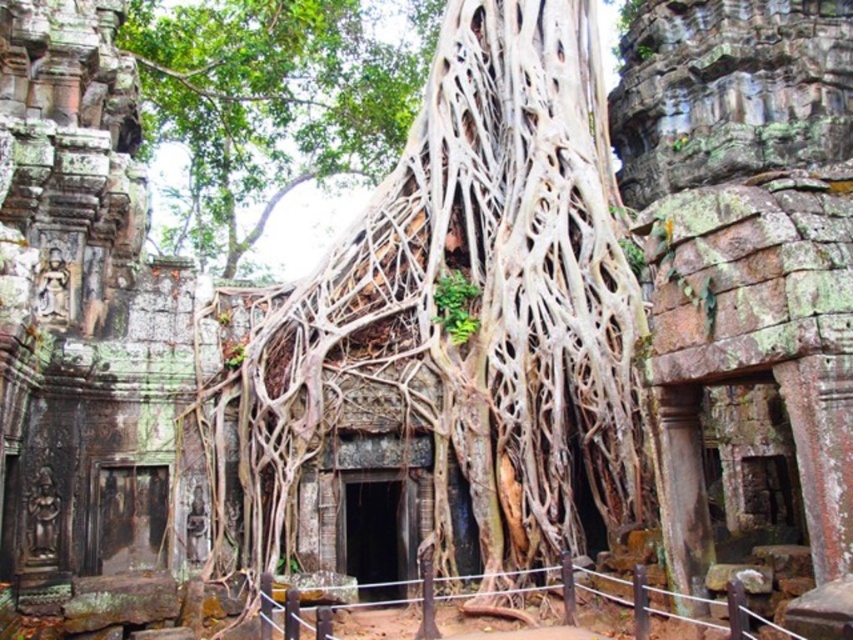
Does brown textured roots at center have a greater height compared to green leafy tree at center?

No.

In the scene shown: Is brown textured roots at center smaller than green leafy tree at center?

Yes.

Between point (469, 310) and point (376, 99), which one is positioned behind?

Positioned behind is point (376, 99).

Find the location of a particular element. Image resolution: width=853 pixels, height=640 pixels. brown textured roots at center is located at coordinates (461, 312).